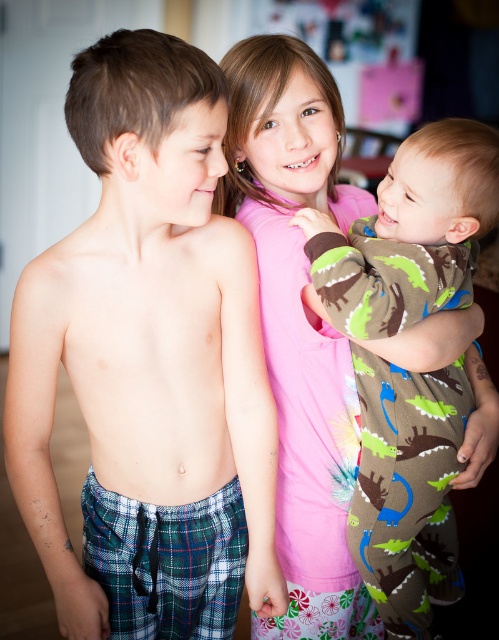
You are a parent trying to pack a small suitcase for a trip. The suitcase can only fit one pair of pants. You have the plaid fabric pants at left and the brown fleece onesie at right. Based on their sizes, which pair of pants should you choose to ensure it fits in the suitcase?

The plaid fabric pants at left has a larger width than the brown fleece onesie at right, so you should choose the brown fleece onesie at right to ensure it fits in the suitcase.

Based on the scene description, where is the plaid fabric pants at left located in the image?

The plaid fabric pants at left are located at point 0.569 on the x axis and 0.299 on the y axis.